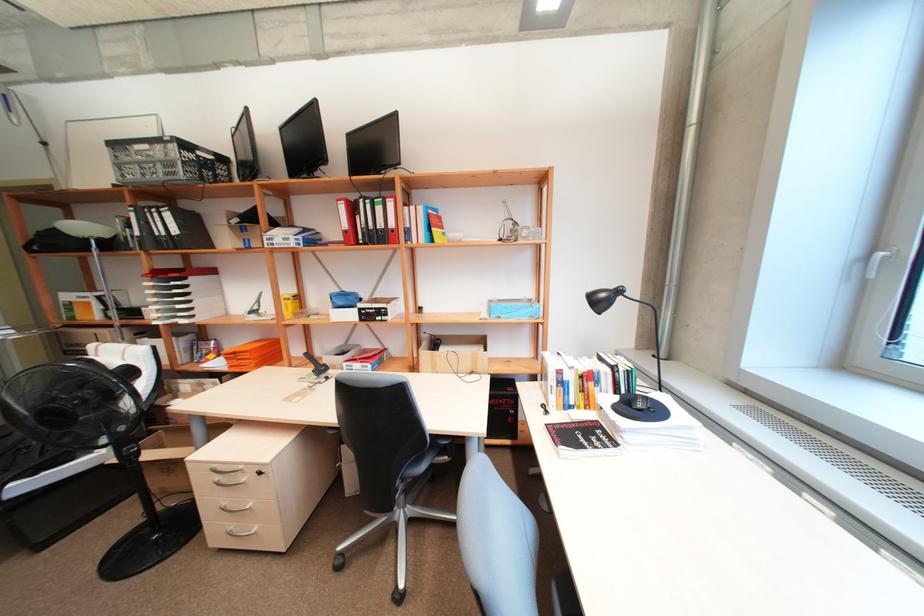
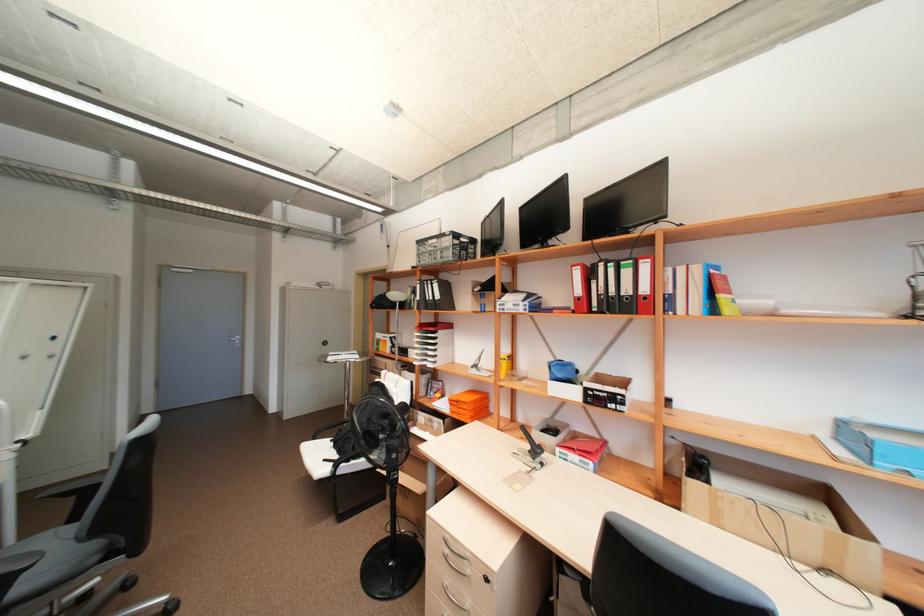
The point at (372,244) is marked in the first image. Where is the corresponding point in the second image?

(610, 313)